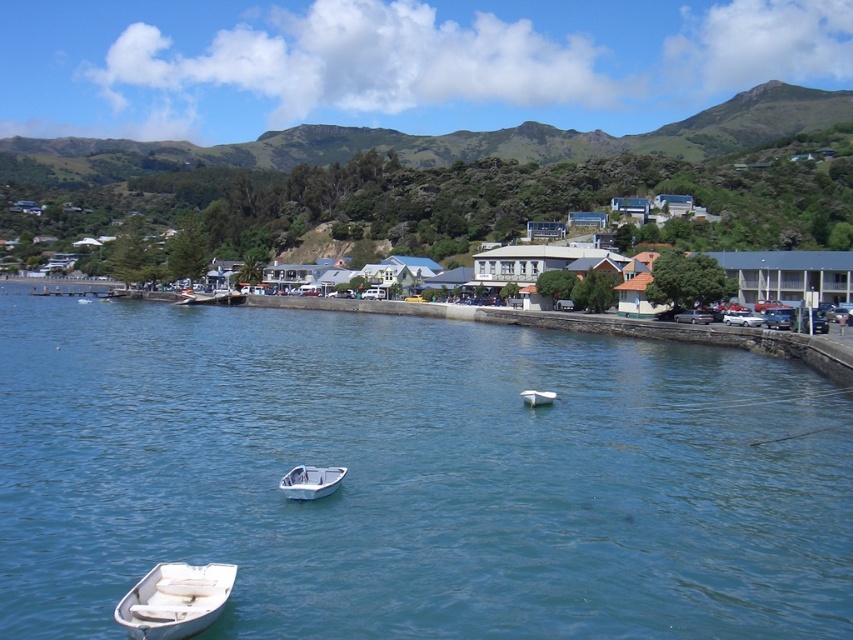
Who is taller, blue glossy water at center or white matte boat at lower left?

blue glossy water at center is taller.

What do you see at coordinates (415, 476) in the screenshot? I see `blue glossy water at center` at bounding box center [415, 476].

Locate an element on the screen. The width and height of the screenshot is (853, 640). blue glossy water at center is located at coordinates (415, 476).

Can you confirm if white plastic boat at center is positioned below white matte boat at center?

Indeed, white plastic boat at center is positioned under white matte boat at center.

Image resolution: width=853 pixels, height=640 pixels. Describe the element at coordinates (310, 481) in the screenshot. I see `white plastic boat at center` at that location.

Identify the location of white plastic boat at center. This screenshot has height=640, width=853. (310, 481).

Who is higher up, white matte boat at lower left or white matte boat at center?

white matte boat at center is above.

Which is in front, point (160, 636) or point (524, 404)?

Point (160, 636)

I want to click on white matte boat at lower left, so click(175, 600).